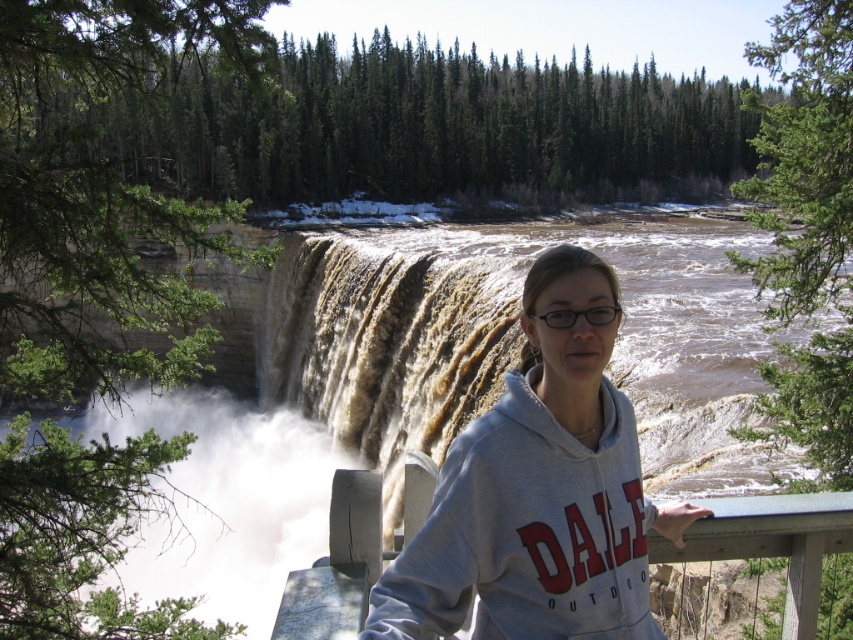
Question: Which point appears closest to the camera in this image?

Choices:
 (A) (312, 422)
 (B) (548, 561)

Answer: (B)

Question: Which point appears closest to the camera in this image?

Choices:
 (A) (397, 285)
 (B) (438, 515)

Answer: (B)

Question: Can you confirm if brown textured water at center is smaller than gray fleece sweatshirt at center?

Choices:
 (A) yes
 (B) no

Answer: (B)

Question: Is brown textured water at center smaller than gray fleece sweatshirt at center?

Choices:
 (A) yes
 (B) no

Answer: (B)

Question: Is brown textured water at center to the left of gray fleece sweatshirt at center from the viewer's perspective?

Choices:
 (A) no
 (B) yes

Answer: (B)